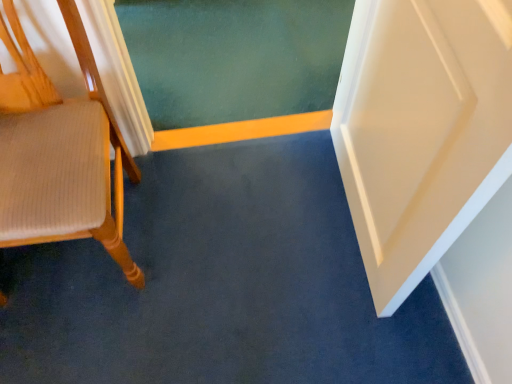
Question: Should I look upward or downward to see wooden chair at left?

Choices:
 (A) down
 (B) up

Answer: (B)

Question: Is wooden chair at left to the left of yellow wood strip at center from the viewer's perspective?

Choices:
 (A) no
 (B) yes

Answer: (B)

Question: From the image's perspective, is wooden chair at left beneath yellow wood strip at center?

Choices:
 (A) no
 (B) yes

Answer: (B)

Question: Is wooden chair at left far away from yellow wood strip at center?

Choices:
 (A) yes
 (B) no

Answer: (B)

Question: Is wooden chair at left positioned with its back to yellow wood strip at center?

Choices:
 (A) yes
 (B) no

Answer: (B)

Question: From a real-world perspective, is wooden chair at left physically above yellow wood strip at center?

Choices:
 (A) yes
 (B) no

Answer: (A)

Question: From the image's perspective, is wooden chair at left on yellow wood strip at center?

Choices:
 (A) yes
 (B) no

Answer: (B)

Question: Is the depth of yellow wood strip at center less than that of wooden chair at left?

Choices:
 (A) no
 (B) yes

Answer: (A)

Question: Does yellow wood strip at center have a greater width compared to wooden chair at left?

Choices:
 (A) no
 (B) yes

Answer: (A)

Question: Are yellow wood strip at center and wooden chair at left far apart?

Choices:
 (A) no
 (B) yes

Answer: (A)

Question: Does yellow wood strip at center have a larger size compared to wooden chair at left?

Choices:
 (A) no
 (B) yes

Answer: (A)

Question: Does yellow wood strip at center touch wooden chair at left?

Choices:
 (A) no
 (B) yes

Answer: (A)

Question: Is the depth of yellow wood strip at center greater than that of wooden chair at left?

Choices:
 (A) yes
 (B) no

Answer: (A)

Question: Is yellow wood strip at center spatially inside wooden chair at left, or outside of it?

Choices:
 (A) outside
 (B) inside

Answer: (A)